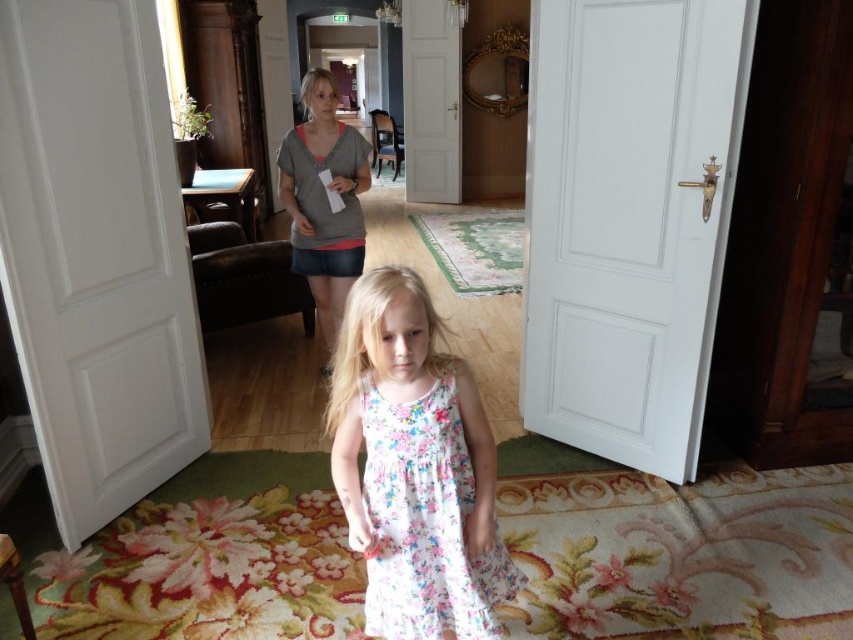
Question: Is floral cotton dress at center to the left of gray cotton shirt at upper center from the viewer's perspective?

Choices:
 (A) yes
 (B) no

Answer: (B)

Question: Which point is closer to the camera?

Choices:
 (A) gray cotton shirt at upper center
 (B) floral cotton dress at center

Answer: (B)

Question: Which point is closer to the camera taking this photo?

Choices:
 (A) (447, 618)
 (B) (294, 244)

Answer: (A)

Question: Does floral cotton dress at center have a larger size compared to gray cotton shirt at upper center?

Choices:
 (A) no
 (B) yes

Answer: (A)

Question: Can you confirm if floral cotton dress at center is smaller than gray cotton shirt at upper center?

Choices:
 (A) yes
 (B) no

Answer: (A)